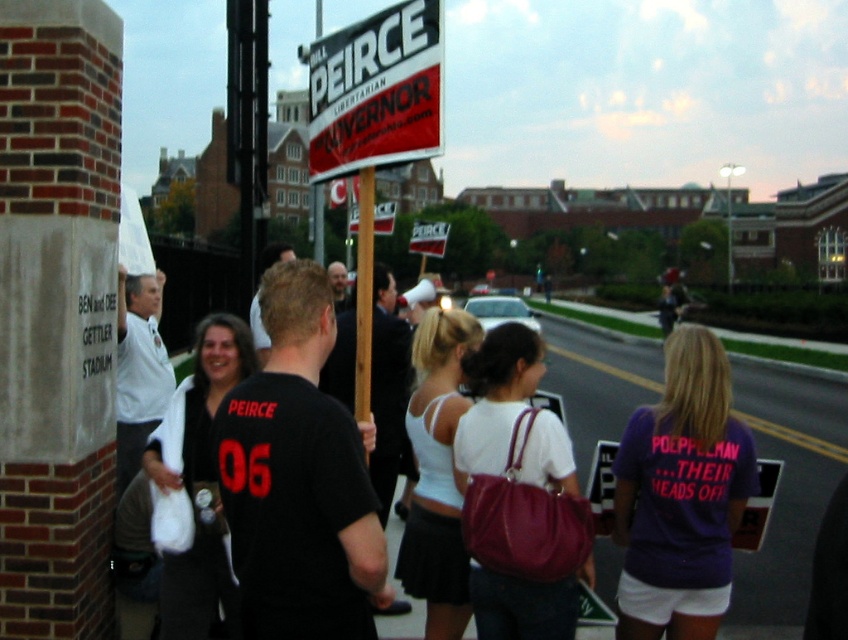
You are a photographer at the political rally. You want to take a photo of the dark brown hair at center and the wooden pole at center. Which object is more to the left?

The dark brown hair at center is more to the left because the wooden pole at center is positioned on the right side of dark brown hair at center.

You are a photographer at the rally and want to take a photo of the wooden pole at center and the dark brown hair at center. Which object should you focus on first if you want to capture both in a single frame without moving the camera?

You should focus on the wooden pole at center first because it is shorter than the dark brown hair at center, allowing you to adjust the camera angle to include both in the frame.